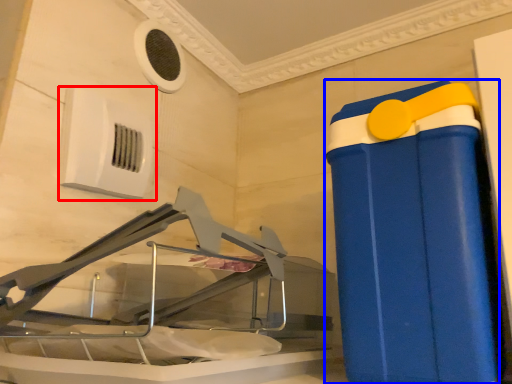
Question: Which point is closer to the camera, air conditioning (highlighted by a red box) or waste container (highlighted by a blue box)?

Choices:
 (A) air conditioning
 (B) waste container

Answer: (B)